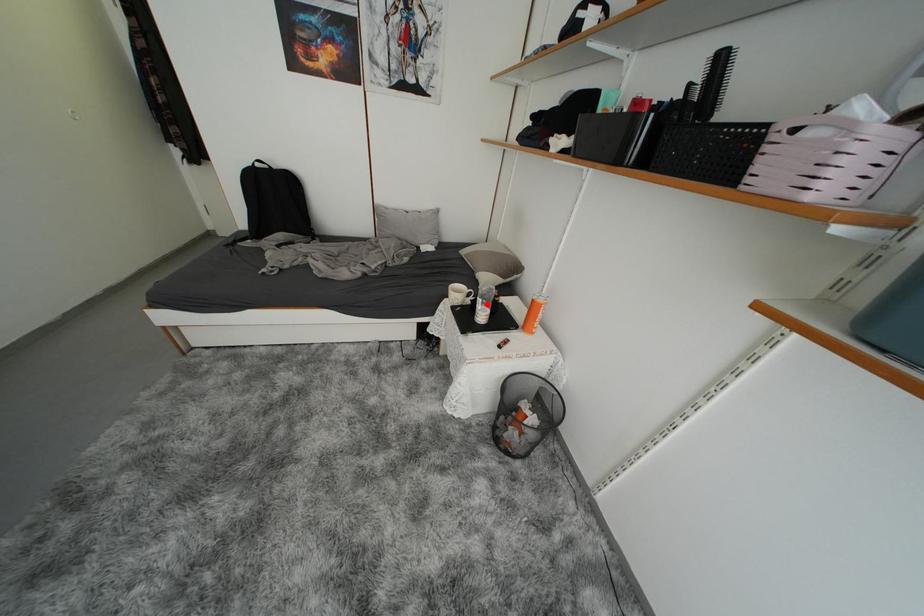
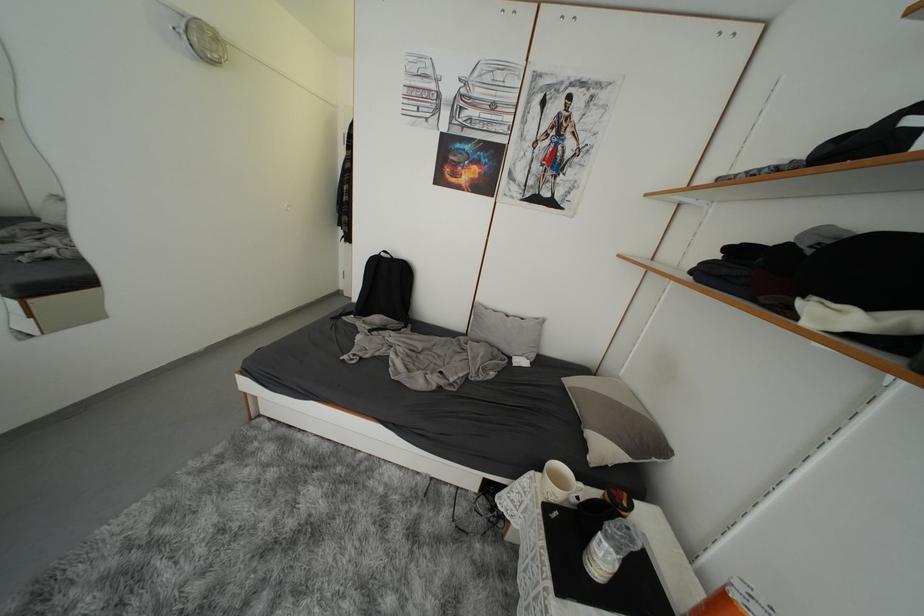
Where in the second image is the point corresponding to the highlighted location from the first image?

(612, 549)